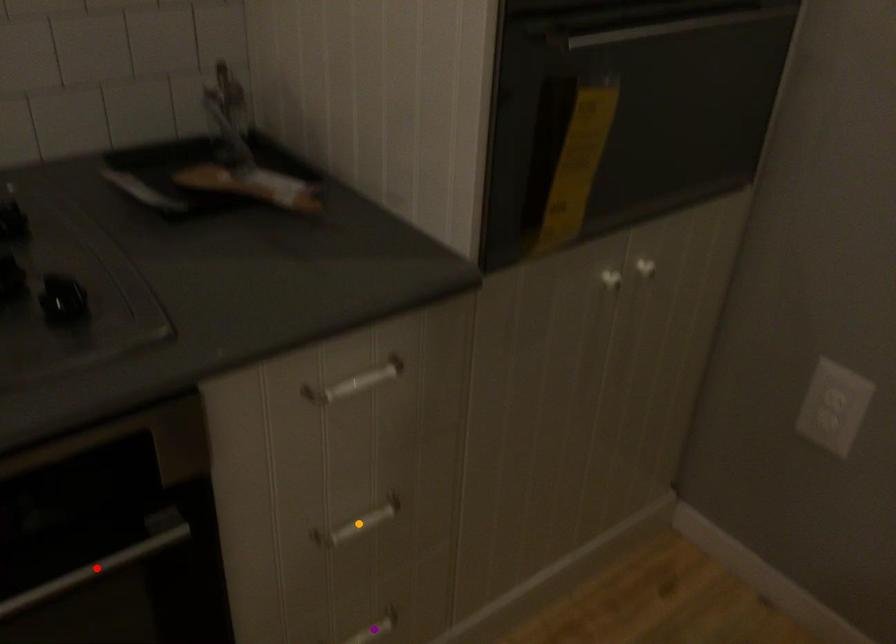
Order these from nearest to farthest:
- red point
- orange point
- purple point

purple point, orange point, red point